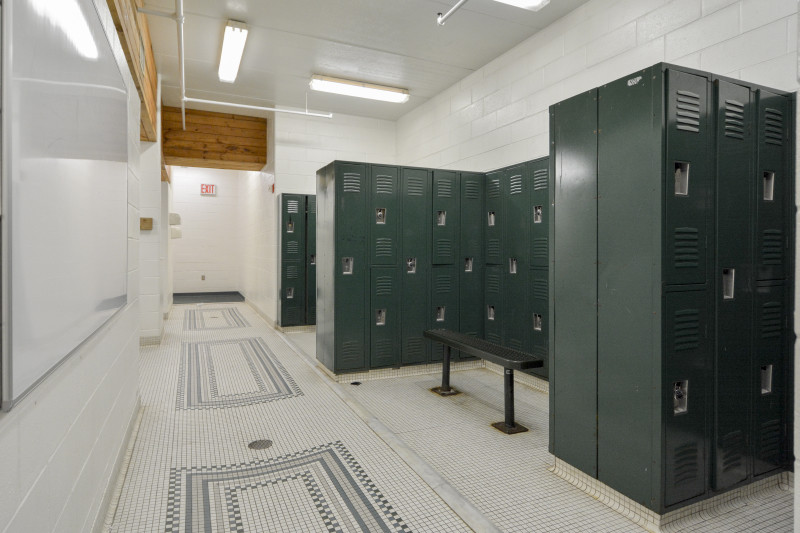
Image resolution: width=800 pixels, height=533 pixels. I want to click on whiteboard, so click(56, 213).